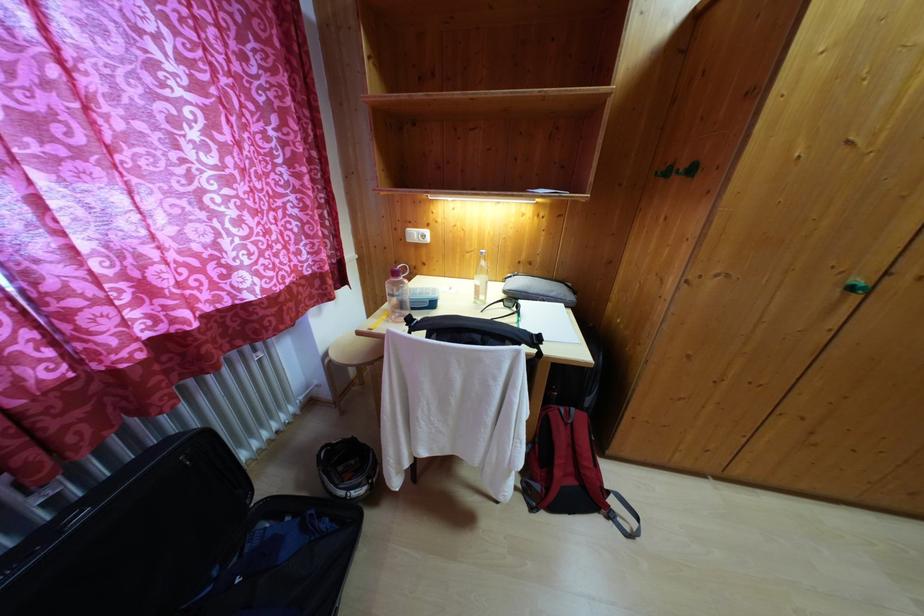
Find where to plugg the white power outlet. Please return your answer as a coordinate pair (x, y).

(417, 235)